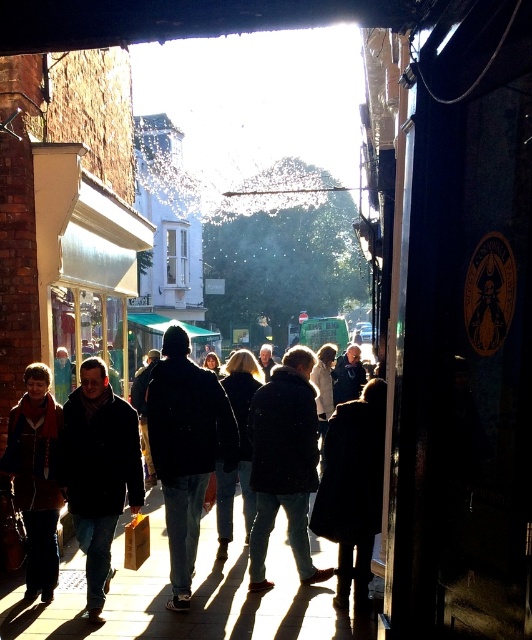
Question: Which of the following is the closest to the observer?

Choices:
 (A) (320, 560)
 (B) (229, 595)
 (C) (37, 451)

Answer: (C)

Question: From the image, what is the correct spatial relationship of dark matte clothing at center in relation to smooth concrete pavement at center?

Choices:
 (A) below
 (B) above

Answer: (B)

Question: Can you confirm if smooth concrete pavement at center is positioned above brown leather jacket at lower left?

Choices:
 (A) no
 (B) yes

Answer: (A)

Question: Which point is farther to the camera?

Choices:
 (A) (51, 589)
 (B) (237, 621)
 (C) (170, 596)

Answer: (C)

Question: Among these objects, which one is nearest to the camera?

Choices:
 (A) smooth concrete pavement at center
 (B) brown leather jacket at lower left
 (C) dark matte clothing at center

Answer: (A)

Question: Can you confirm if dark matte clothing at center is smaller than brown leather jacket at lower left?

Choices:
 (A) no
 (B) yes

Answer: (A)